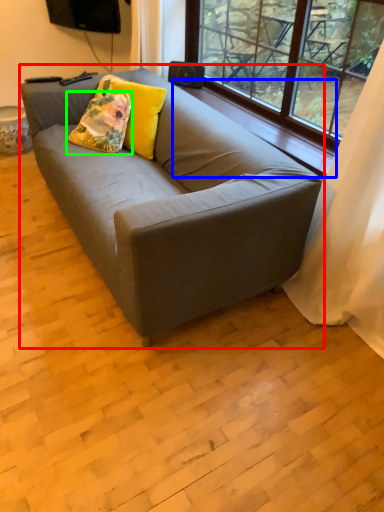
Question: Based on their relative distances, which object is farther from studio couch (highlighted by a red box)? Choose from window sill (highlighted by a blue box) and throw pillow (highlighted by a green box).

Choices:
 (A) window sill
 (B) throw pillow

Answer: (A)